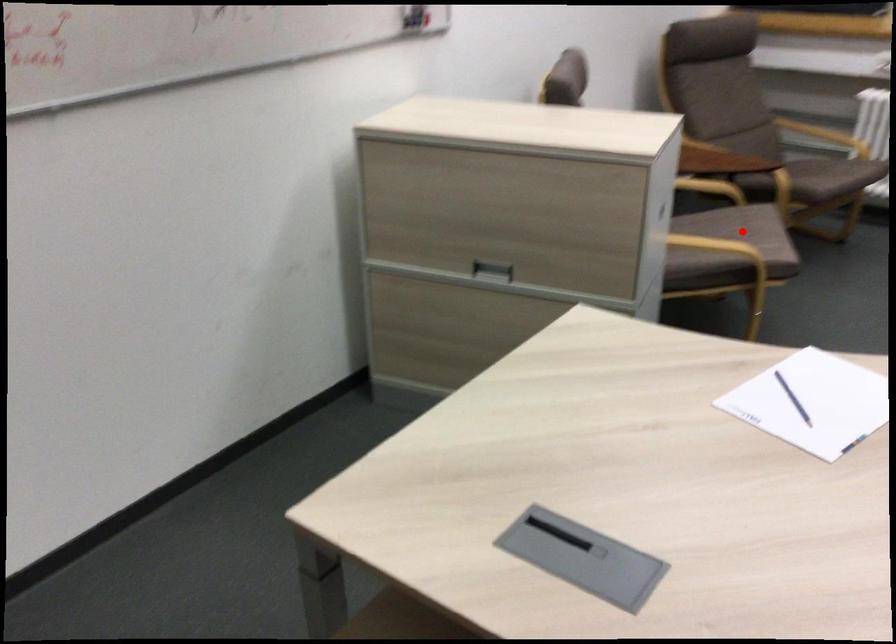
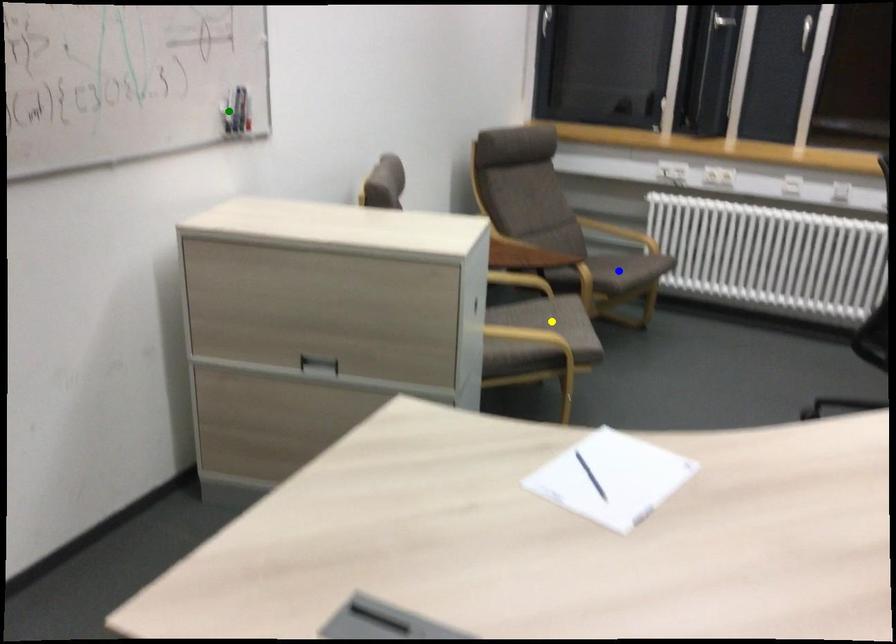
Question: I am providing you with two images of the same scene from different viewpoints. A red point is marked on the first image. You are given multiple points on the second image. Can you choose the point in image 2 that corresponds to the point in image 1?

Choices:
 (A) green point
 (B) blue point
 (C) yellow point

Answer: (C)